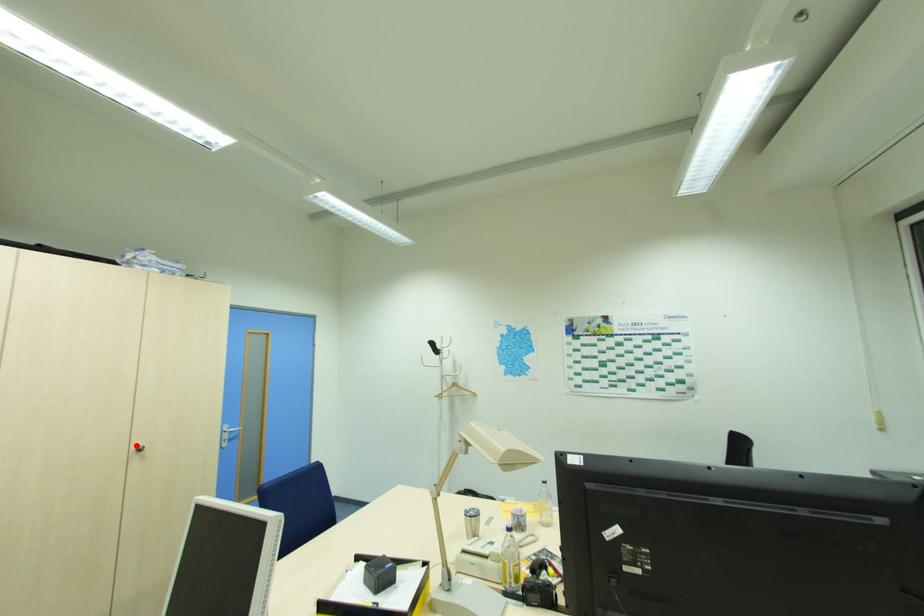
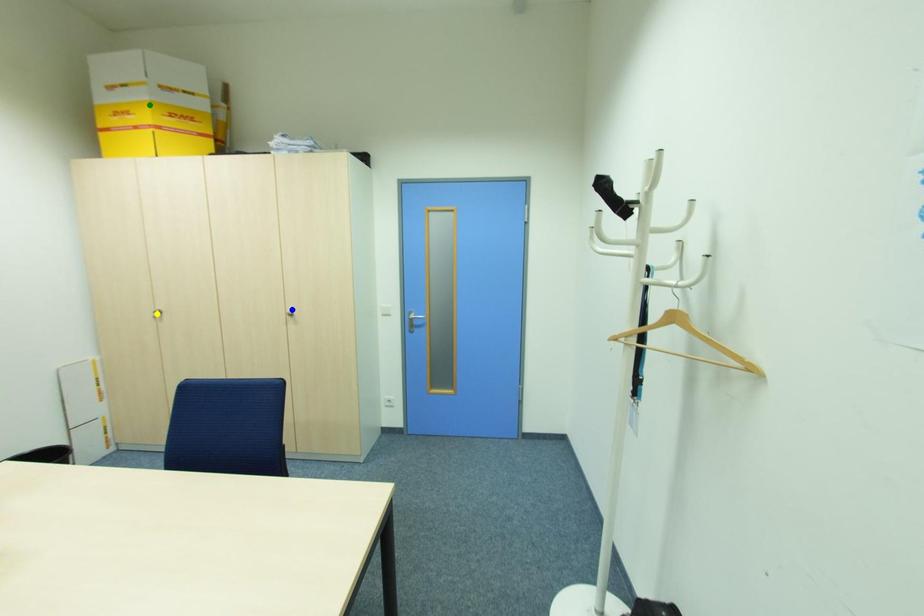
Question: I am providing you with two images of the same scene from different viewpoints. A red point is marked on the first image. You are given multiple points on the second image. In image 2, which mark is for the same physical point as the one in image 1?

Choices:
 (A) green point
 (B) blue point
 (C) yellow point

Answer: (B)